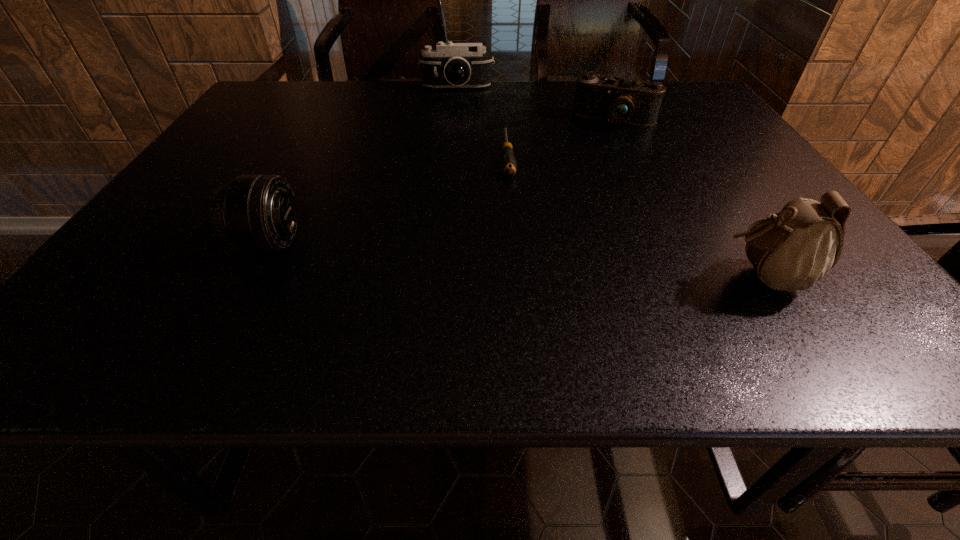
Identify the location of free space located 0.140m on the front-facing side of the pouch. This screenshot has width=960, height=540. (638, 278).

Image resolution: width=960 pixels, height=540 pixels. I want to click on free space located on the front-facing side of the pouch, so click(563, 278).

I want to click on vacant space situated 0.180m on the lens of the shorter camera, so click(595, 166).

You are a GUI agent. You are given a task and a screenshot of the screen. Output one action in this format:
    pyautogui.click(x=<x>, y=<y>)
    Task: Click on the vacant space located on the lens of the shorter camera
    Image resolution: width=960 pixels, height=540 pixels.
    Given the screenshot: What is the action you would take?
    pyautogui.click(x=597, y=160)

The height and width of the screenshot is (540, 960). I want to click on free space located on the lens of the shorter camera, so click(x=594, y=168).

Locate an element on the screen. The image size is (960, 540). vacant position located at the tip of the shortest object is located at coordinates (516, 246).

Find the location of a particular element. The width and height of the screenshot is (960, 540). vacant region located 0.150m at the tip of the shortest object is located at coordinates (514, 222).

At what (x,y) coordinates should I click in order to perform the action: click on vacant area situated at the tip of the shortest object. Please return your answer as a coordinate pair (x, y). The width and height of the screenshot is (960, 540). Looking at the image, I should click on (521, 293).

Where is `free space located on the front lens of the left camera`? The width and height of the screenshot is (960, 540). free space located on the front lens of the left camera is located at coordinates (457, 124).

I want to click on vacant space located 0.170m on the front lens of the left camera, so click(457, 120).